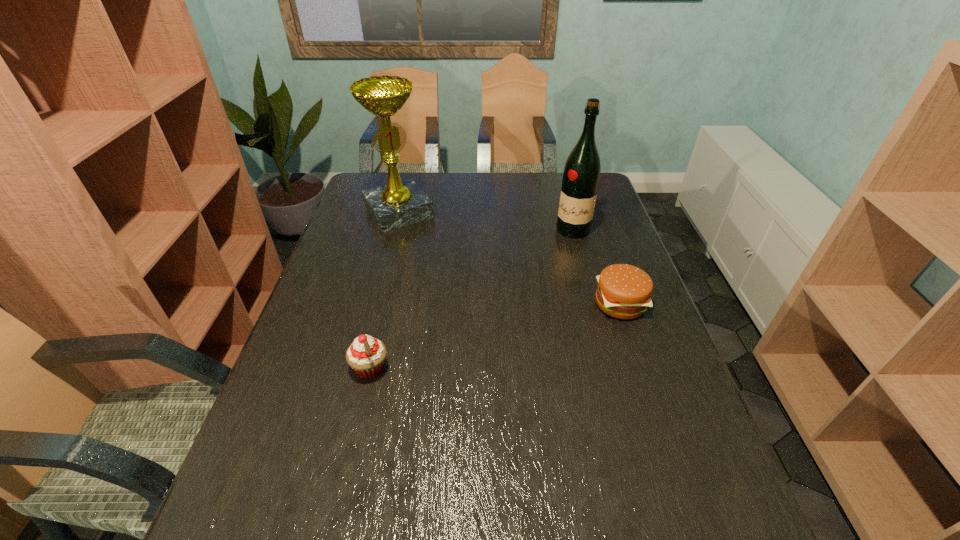
Identify the location of free spot between the liquor and the hamburger. This screenshot has width=960, height=540. (596, 267).

This screenshot has width=960, height=540. In order to click on vacant area that lies between the liquor and the hamburger in this screenshot , I will do `click(596, 267)`.

At what (x,y) coordinates should I click in order to perform the action: click on free space between the liquor and the nearest object. Please return your answer as a coordinate pair (x, y). Looking at the image, I should click on (471, 299).

I want to click on empty space between the award and the liquor, so click(486, 221).

Locate an element on the screen. The width and height of the screenshot is (960, 540). vacant space in between the liquor and the shortest object is located at coordinates (596, 267).

Choose which object is the second nearest neighbor to the second shortest object. Please provide its 2D coordinates. Your answer should be formatted as a tuple, i.e. [(x, y)], where the tuple contains the x and y coordinates of a point satisfying the conditions above.

[(624, 291)]

Where is `the closest object to the award`? Image resolution: width=960 pixels, height=540 pixels. the closest object to the award is located at coordinates (581, 176).

Locate an element on the screen. vacant region that satisfies the following two spatial constraints: 1. on the front side of the second nearest object; 2. on the right side of the liquor is located at coordinates (593, 303).

Locate an element on the screen. The image size is (960, 540). free point that satisfies the following two spatial constraints: 1. on the back side of the third tallest object; 2. on the left side of the liquor is located at coordinates (402, 230).

Find the location of a particular element. The image size is (960, 540). vacant space that satisfies the following two spatial constraints: 1. on the back side of the cupcake; 2. on the left side of the liquor is located at coordinates (402, 230).